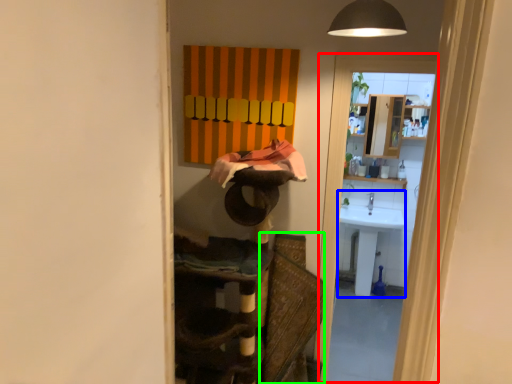
Question: Which is farther away from screen door (highlighted by a red box)? sink (highlighted by a blue box) or swivel chair (highlighted by a green box)?

Choices:
 (A) sink
 (B) swivel chair

Answer: (A)